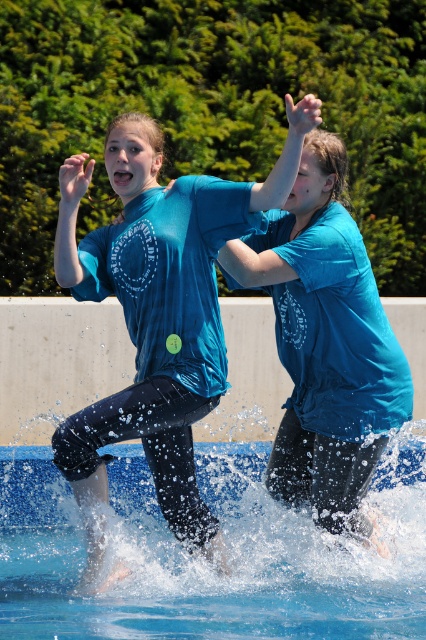
Question: Does matte blue t-shirt at center have a lesser width compared to matte blue shirt at center?

Choices:
 (A) yes
 (B) no

Answer: (B)

Question: Among these objects, which one is farthest from the camera?

Choices:
 (A) matte blue shirt at center
 (B) matte blue t-shirt at center

Answer: (A)

Question: Which point is farther to the camera?

Choices:
 (A) blue rubber swimming pool at lower center
 (B) matte blue shirt at center

Answer: (B)

Question: Considering the real-world distances, which object is farthest from the blue rubber swimming pool at lower center?

Choices:
 (A) matte blue t-shirt at center
 (B) matte blue shirt at center

Answer: (A)

Question: Is blue rubber swimming pool at lower center thinner than matte blue shirt at center?

Choices:
 (A) yes
 (B) no

Answer: (B)

Question: Is matte blue t-shirt at center to the right of matte blue shirt at center from the viewer's perspective?

Choices:
 (A) yes
 (B) no

Answer: (B)